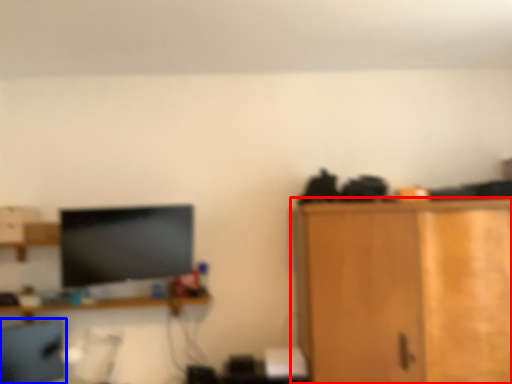
Question: Which of the following is the closest to the observer, cabinetry (highlighted by a red box) or computer chair (highlighted by a blue box)?

Choices:
 (A) cabinetry
 (B) computer chair

Answer: (A)